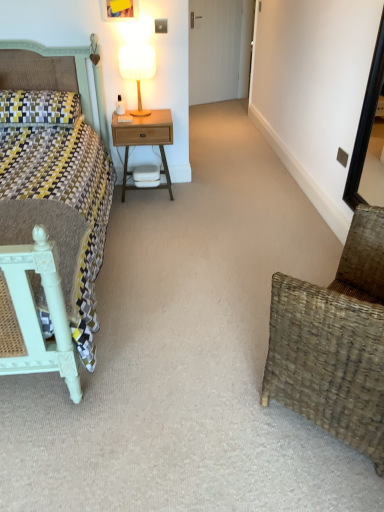
Question: Should I look upward or downward to see woodenmaterial/texturenightstand at center?

Choices:
 (A) up
 (B) down

Answer: (A)

Question: Is white glossy door at upper center to the left of yellow and gray woven pillow at left from the viewer's perspective?

Choices:
 (A) yes
 (B) no

Answer: (B)

Question: Could you tell me if white glossy door at upper center is turned towards yellow and gray woven pillow at left?

Choices:
 (A) no
 (B) yes

Answer: (A)

Question: Is white glossy door at upper center outside of yellow and gray woven pillow at left?

Choices:
 (A) no
 (B) yes

Answer: (B)

Question: Considering the relative sizes of white glossy door at upper center and yellow and gray woven pillow at left in the image provided, is white glossy door at upper center wider than yellow and gray woven pillow at left?

Choices:
 (A) yes
 (B) no

Answer: (B)

Question: Is white glossy door at upper center bigger than yellow and gray woven pillow at left?

Choices:
 (A) no
 (B) yes

Answer: (B)

Question: Is white glossy door at upper center positioned in front of yellow and gray woven pillow at left?

Choices:
 (A) yes
 (B) no

Answer: (B)

Question: Does black wooden mirror at right have a lesser width compared to white glossy door at upper center?

Choices:
 (A) no
 (B) yes

Answer: (B)

Question: Does black wooden mirror at right have a greater width compared to white glossy door at upper center?

Choices:
 (A) yes
 (B) no

Answer: (B)

Question: Is black wooden mirror at right at the right side of white glossy door at upper center?

Choices:
 (A) yes
 (B) no

Answer: (A)

Question: Is black wooden mirror at right looking in the opposite direction of white glossy door at upper center?

Choices:
 (A) yes
 (B) no

Answer: (B)

Question: Is the surface of black wooden mirror at right in direct contact with white glossy door at upper center?

Choices:
 (A) no
 (B) yes

Answer: (A)

Question: Does black wooden mirror at right have a smaller size compared to white glossy door at upper center?

Choices:
 (A) no
 (B) yes

Answer: (B)

Question: Is matte green bed at left not close to yellow and gray woven pillow at left?

Choices:
 (A) yes
 (B) no

Answer: (B)